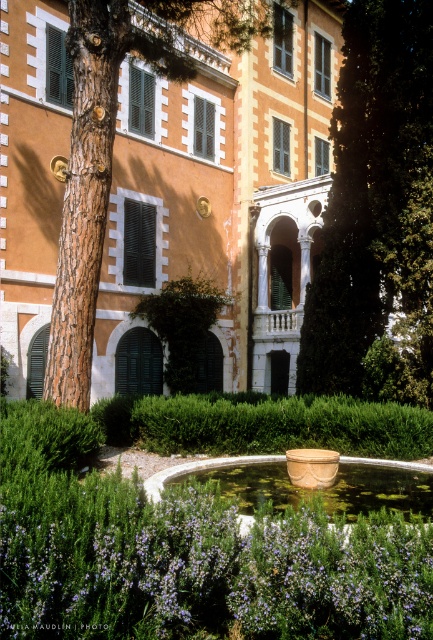
Consider the image. You are standing in the garden of the historic building and want to place a small statue between the green leafy tree at center and the green matte bush at center. Based on their positions, which object should the statue be closer to?

The green leafy tree at center is positioned on the right side of green matte bush at center, so the statue should be placed closer to the green leafy tree at center to maintain symmetry between the two objects.

You are standing in the garden of the historic building and want to walk from point (320, 342) to point (184, 468). Which direction should you move relative to your current position?

You should move away from the building because point (320, 342) is closer to you than point (184, 468), so moving away from the building will take you towards the latter point.